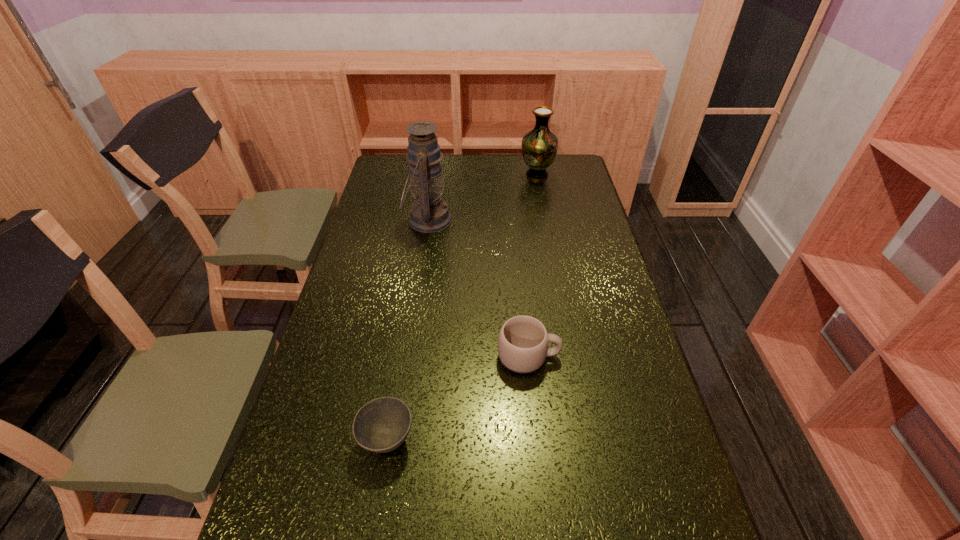
Choose which object is the nearest neighbor to the nearest object. Please provide its 2D coordinates. Your answer should be formatted as a tuple, i.e. [(x, y)], where the tuple contains the x and y coordinates of a point satisfying the conditions above.

[(523, 340)]

Identify the location of object that ranks as the second closest to the tallest object. (523, 340).

In order to click on free space that satisfies the following two spatial constraints: 1. on the side of the third farthest object with the handle; 2. on the front side of the shortest object in this screenshot , I will do pos(537,440).